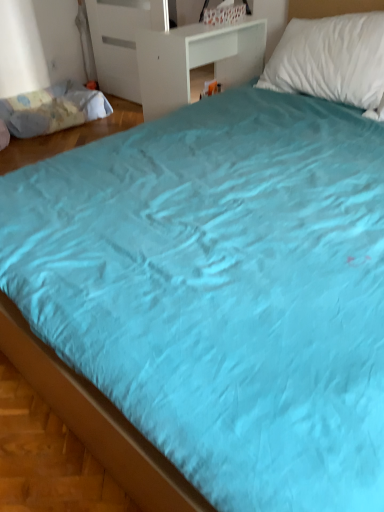
Describe the element at coordinates (194, 59) in the screenshot. I see `white matte table at upper center` at that location.

Where is `white matte table at upper center`? Image resolution: width=384 pixels, height=512 pixels. white matte table at upper center is located at coordinates (194, 59).

Describe the element at coordinates (52, 109) in the screenshot. The height and width of the screenshot is (512, 384). I see `light blue fabric mattress at left` at that location.

You are a GUI agent. You are given a task and a screenshot of the screen. Output one action in this format:
    pyautogui.click(x=<x>, y=<y>)
    Task: Click on the light blue fabric mattress at left
    
    Given the screenshot: What is the action you would take?
    (52, 109)

In order to click on white matte table at upper center in this screenshot , I will do `click(194, 59)`.

In the image, is white matte table at upper center on the left side or the right side of light blue fabric mattress at left?

From the image, it's evident that white matte table at upper center is to the right of light blue fabric mattress at left.

Is the position of white matte table at upper center more distant than that of light blue fabric mattress at left?

No, it is in front of light blue fabric mattress at left.

Between point (196, 53) and point (78, 111), which one is positioned behind?

The point (78, 111) is behind.

From the image's perspective, which one is positioned higher, white matte table at upper center or light blue fabric mattress at left?

light blue fabric mattress at left, from the image's perspective.

From a real-world perspective, is white matte table at upper center physically located above or below light blue fabric mattress at left?

In terms of real-world spatial position, white matte table at upper center is above light blue fabric mattress at left.

Considering the sizes of white matte table at upper center and light blue fabric mattress at left in the image, is white matte table at upper center wider or thinner than light blue fabric mattress at left?

In the image, white matte table at upper center appears to be more narrow than light blue fabric mattress at left.

Is white matte table at upper center shorter than light blue fabric mattress at left?

In fact, white matte table at upper center may be taller than light blue fabric mattress at left.

Can you confirm if white matte table at upper center is smaller than light blue fabric mattress at left?

Actually, white matte table at upper center might be larger than light blue fabric mattress at left.

Can we say white matte table at upper center lies outside light blue fabric mattress at left?

Indeed, white matte table at upper center is completely outside light blue fabric mattress at left.

Would you consider white matte table at upper center to be distant from light blue fabric mattress at left?

Indeed, white matte table at upper center is not near light blue fabric mattress at left.

Could you tell me if white matte table at upper center is facing light blue fabric mattress at left?

Yes, white matte table at upper center is facing light blue fabric mattress at left.

This screenshot has width=384, height=512. In order to click on mattress that appears above the white matte table at upper center (from the image's perspective) in this screenshot , I will do `click(52, 109)`.

Which object is positioned more to the left, light blue fabric mattress at left or white matte table at upper center?

light blue fabric mattress at left is more to the left.

In the scene shown: Does light blue fabric mattress at left come in front of white matte table at upper center?

No, the depth of light blue fabric mattress at left is greater than that of white matte table at upper center.

Considering the points (110, 109) and (218, 32), which point is in front, point (110, 109) or point (218, 32)?

Positioned in front is point (218, 32).

From the image's perspective, is light blue fabric mattress at left above or below white matte table at upper center?

From the image's perspective, light blue fabric mattress at left appears above white matte table at upper center.

From a real-world perspective, does light blue fabric mattress at left stand above white matte table at upper center?

No.

Considering the sizes of light blue fabric mattress at left and white matte table at upper center in the image, is light blue fabric mattress at left wider or thinner than white matte table at upper center?

Clearly, light blue fabric mattress at left has more width compared to white matte table at upper center.

Which of these two, light blue fabric mattress at left or white matte table at upper center, stands shorter?

With less height is light blue fabric mattress at left.

Is light blue fabric mattress at left bigger or smaller than white matte table at upper center?

Clearly, light blue fabric mattress at left is smaller in size than white matte table at upper center.

Would you say white matte table at upper center is part of light blue fabric mattress at left's contents?

Actually, white matte table at upper center is outside light blue fabric mattress at left.

Is light blue fabric mattress at left placed right next to white matte table at upper center?

No, light blue fabric mattress at left is not touching white matte table at upper center.

Does light blue fabric mattress at left turn towards white matte table at upper center?

Yes, light blue fabric mattress at left faces towards white matte table at upper center.

I want to click on table located on the right of light blue fabric mattress at left, so click(x=194, y=59).

Image resolution: width=384 pixels, height=512 pixels. What are the coordinates of `table in front of the light blue fabric mattress at left` in the screenshot? It's located at (194, 59).

Identify the location of mattress above the white matte table at upper center (from the image's perspective). The width and height of the screenshot is (384, 512). (52, 109).